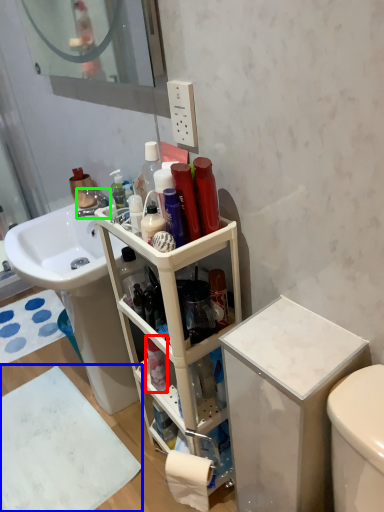
Question: Considering the real-world distances, which object is farthest from toiletry (highlighted by a red box)? bath mat (highlighted by a blue box) or faucet (highlighted by a green box)?

Choices:
 (A) bath mat
 (B) faucet

Answer: (B)